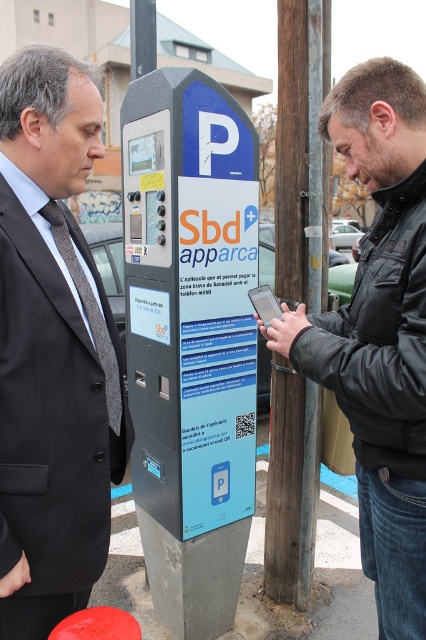
You are a delivery person who needs to place a package between the dark gray suit at left and the matte black phone at center. Can you fit the package there?

The dark gray suit at left might be wider than matte black phone at center, so the space between them may be sufficient to fit the package.

You are a security guard at the parking lot and need to identify which person is closer to the kiosk. The people are wearing a dark gray suit at left and a black leather jacket at center. Based on their clothing, can you determine which person is closer to the kiosk?

The dark gray suit at left is smaller than the black leather jacket at center, which suggests that the person in the dark gray suit at left is farther away from the kiosk, making the person in the black leather jacket at center closer to the kiosk.